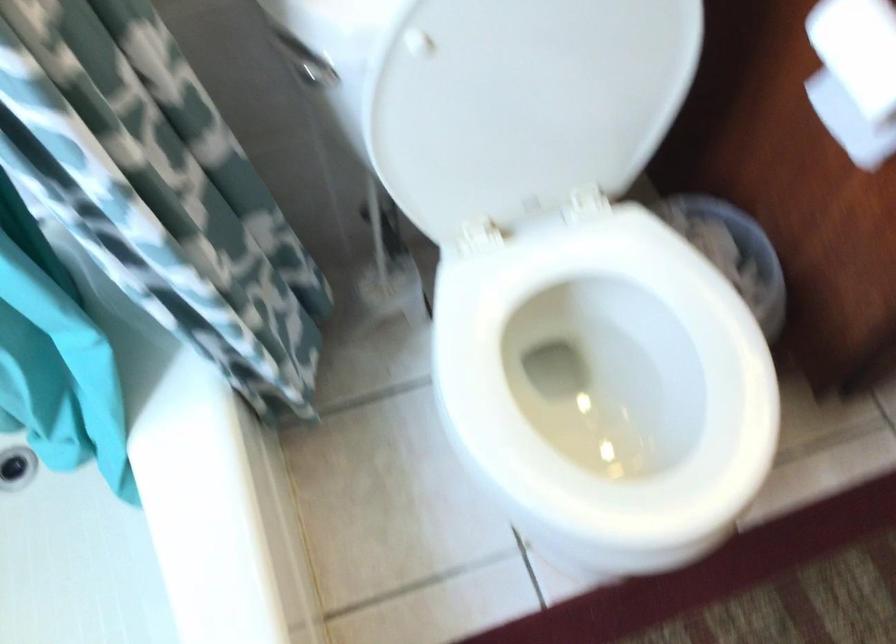
Describe the element at coordinates (855, 76) in the screenshot. I see `the toilet paper roll` at that location.